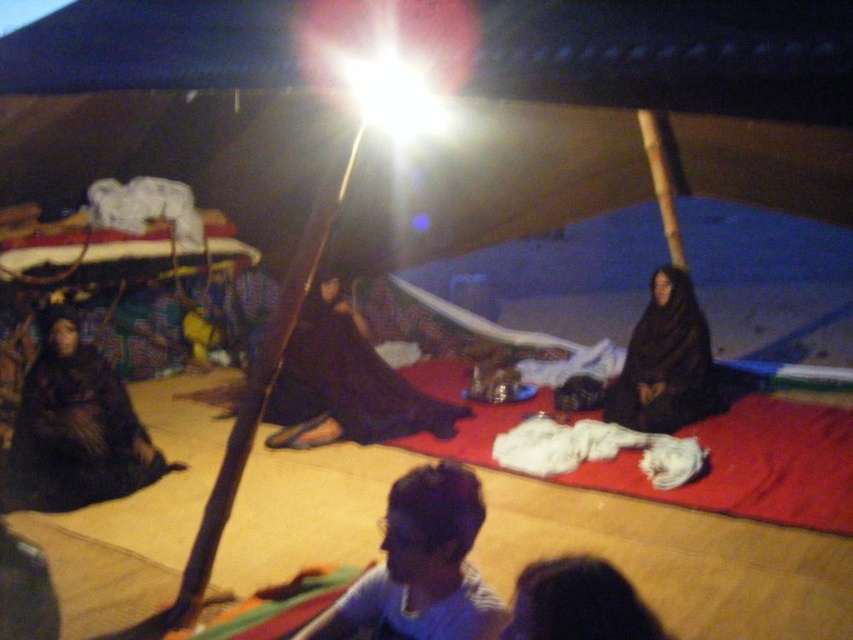
Where is `black matte dress at left`? The width and height of the screenshot is (853, 640). black matte dress at left is located at coordinates (74, 428).

Does black matte dress at left come behind black matte dress at center?

No, black matte dress at left is in front of black matte dress at center.

You are a GUI agent. You are given a task and a screenshot of the screen. Output one action in this format:
    pyautogui.click(x=<x>, y=<y>)
    Task: Click on the black matte dress at left
    Image resolution: width=853 pixels, height=640 pixels.
    Given the screenshot: What is the action you would take?
    pyautogui.click(x=74, y=428)

The height and width of the screenshot is (640, 853). What do you see at coordinates (421, 566) in the screenshot?
I see `blue fabric shirt at center` at bounding box center [421, 566].

Who is positioned more to the right, blue fabric shirt at center or black matte dress at center?

From the viewer's perspective, black matte dress at center appears more on the right side.

Which is behind, point (453, 588) or point (675, 362)?

Point (675, 362)

Where is `blue fabric shirt at center`? The image size is (853, 640). blue fabric shirt at center is located at coordinates (421, 566).

Which is in front, point (311, 396) or point (647, 352)?

Point (311, 396)

Does black fabric at center appear on the left side of black matte dress at center?

Indeed, black fabric at center is positioned on the left side of black matte dress at center.

Is point (326, 429) closer to viewer compared to point (703, 381)?

Yes.

The height and width of the screenshot is (640, 853). Identify the location of black fabric at center. (345, 384).